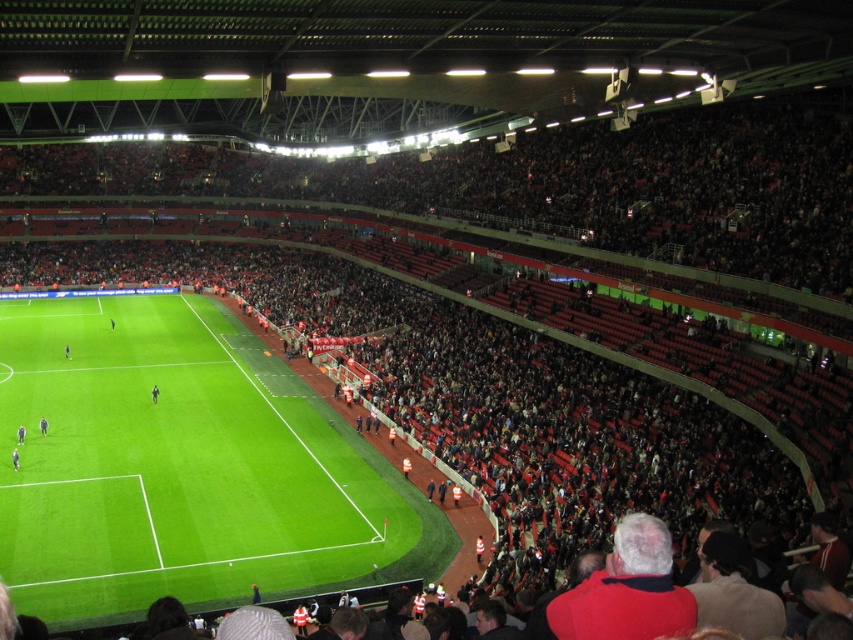
You are a photographer standing at the edge of the field. You see the dark blue jersey at center and the dark gray fabric jacket at lower left. Which object is positioned more to the right from your viewpoint?

The dark blue jersey at center is positioned more to the right compared to the dark gray fabric jacket at lower left, as it is stated to be to the right of it.

You are a photographer standing at the camera position in the stadium. You want to capture a closeup shot of the dark gray fabric jacket at lower left. Given that your camera can focus on objects within 100 feet, will you be able to take the photo without moving closer?

The dark gray fabric jacket at lower left is 135.80 feet from the camera, which is beyond the camera focus range of 100 feet. Therefore, you cannot take a clear closeup shot without moving closer.